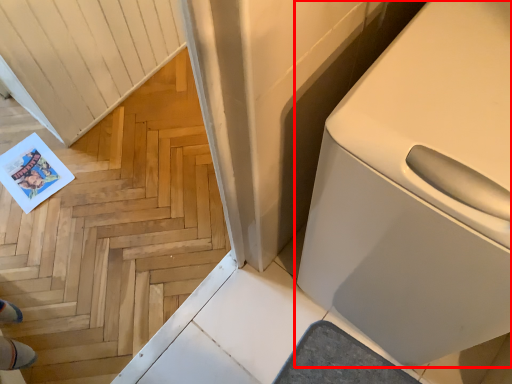
Question: Observing the image, what is the correct spatial positioning of home appliance (annotated by the red box) in reference to stairwell?

Choices:
 (A) left
 (B) right

Answer: (B)